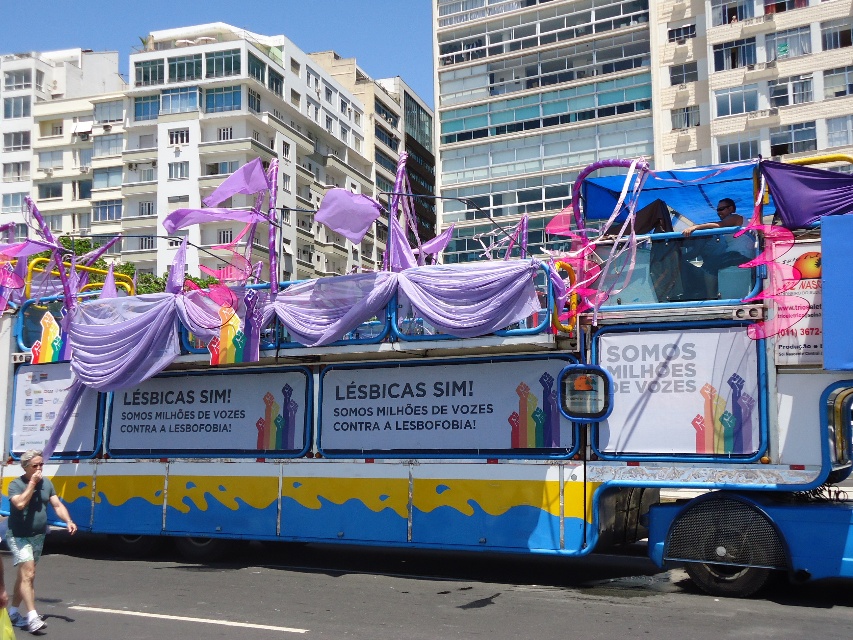
Which of these two, matte purple fabric at center or matte blue shirt at center, stands shorter?

With less height is matte purple fabric at center.

Which is behind, point (845, 508) or point (711, 262)?

The point (711, 262) is more distant.

At what (x,y) coordinates should I click in order to perform the action: click on matte purple fabric at center. Please return your answer as a coordinate pair (x, y). The height and width of the screenshot is (640, 853). Looking at the image, I should click on (491, 429).

Measure the distance from gray fabric shorts at lower left to matte blue shirt at center.

gray fabric shorts at lower left is 5.33 meters from matte blue shirt at center.

Describe the element at coordinates (28, 532) in the screenshot. The image size is (853, 640). I see `gray fabric shorts at lower left` at that location.

At what (x,y) coordinates should I click in order to perform the action: click on gray fabric shorts at lower left. Please return your answer as a coordinate pair (x, y). The height and width of the screenshot is (640, 853). Looking at the image, I should click on (28, 532).

Identify the location of gray fabric shorts at lower left. The height and width of the screenshot is (640, 853). tap(28, 532).

Consider the image. Is matte purple fabric at center smaller than gray fabric shorts at lower left?

Correct, matte purple fabric at center occupies less space than gray fabric shorts at lower left.

Does point (514, 371) come behind point (32, 502)?

Yes, it is.

Between point (734, 582) and point (20, 541), which one is positioned behind?

The point (734, 582) is more distant.

Locate an element on the screen. matte purple fabric at center is located at coordinates (491, 429).